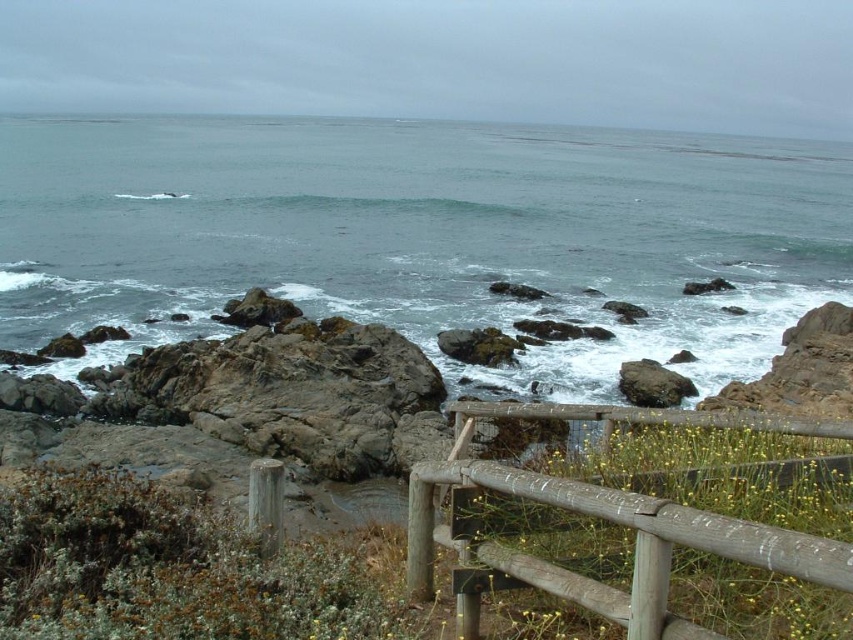
Is point (547, 188) closer to camera compared to point (722, 422)?

No, it is not.

Between gray rock at center and brown wooden fence at center, which one appears on the left side from the viewer's perspective?

brown wooden fence at center

Does point (108, 288) come farther from viewer compared to point (544, 497)?

Yes, it is behind point (544, 497).

I want to click on gray rock at center, so click(x=422, y=234).